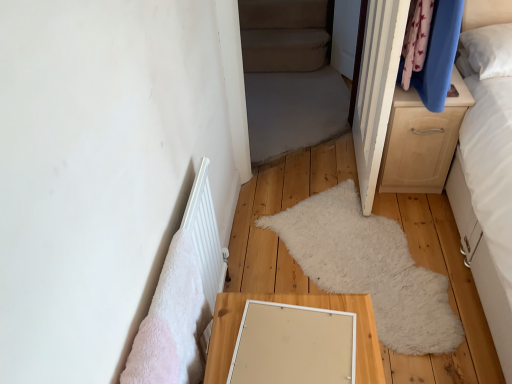
Where is `vacant region in front of white wood door at upper right`? The height and width of the screenshot is (384, 512). vacant region in front of white wood door at upper right is located at coordinates coord(372,235).